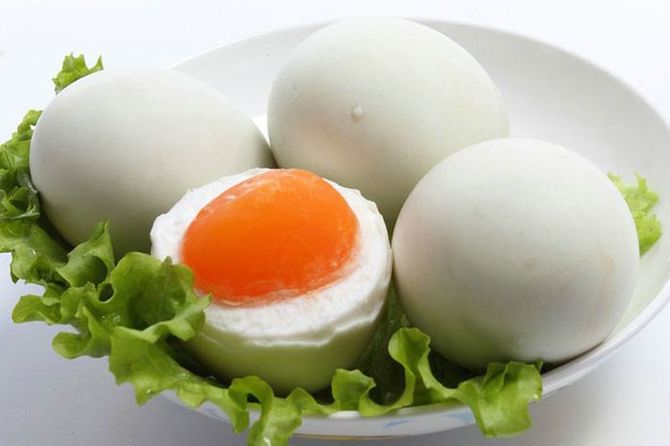
At what (x,y) coordinates should I click in order to perform the action: click on bowl. Please return your answer as a coordinate pair (x, y). The image size is (670, 446). Looking at the image, I should click on (348, 420).